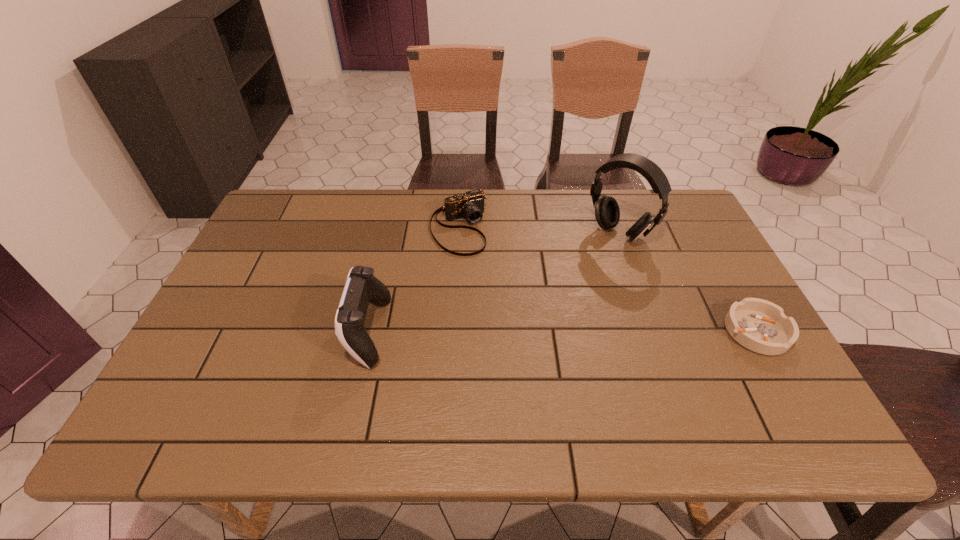
Locate an element on the screen. object that is at the near edge is located at coordinates (362, 287).

You are a GUI agent. You are given a task and a screenshot of the screen. Output one action in this format:
    pyautogui.click(x=<x>, y=<y>)
    Task: Click on the object at the right edge
    The width and height of the screenshot is (960, 540).
    Given the screenshot: What is the action you would take?
    pyautogui.click(x=761, y=326)

In the image, there is a desktop. In order to click on vacant region at the far edge in this screenshot , I will do `click(376, 204)`.

This screenshot has height=540, width=960. I want to click on vacant space at the near edge of the desktop, so point(476,393).

At what (x,y) coordinates should I click in order to perform the action: click on vacant point at the left edge. Please return your answer as a coordinate pair (x, y). This screenshot has height=540, width=960. Looking at the image, I should click on click(260, 263).

The image size is (960, 540). In order to click on vacant space at the right edge in this screenshot , I will do `click(719, 266)`.

The image size is (960, 540). I want to click on vacant area that lies between the leftmost object and the rightmost object, so click(x=562, y=332).

Find the location of `vacant space in between the shortest object and the second tallest object`. vacant space in between the shortest object and the second tallest object is located at coordinates (562, 332).

Locate an element on the screen. This screenshot has height=540, width=960. blank region between the earphone and the camera is located at coordinates (539, 231).

The image size is (960, 540). I want to click on free space between the tallest object and the rightmost object, so click(x=687, y=282).